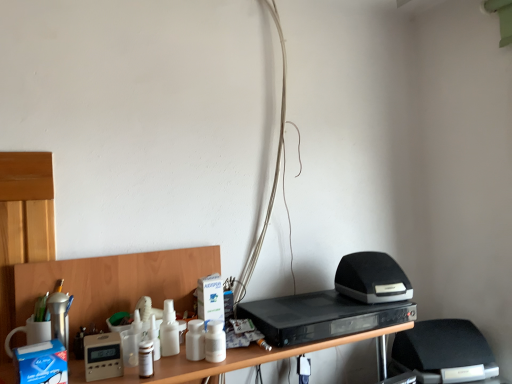
The image size is (512, 384). I want to click on blank space situated above black plastic dvd player at center (from a real-world perspective), so click(334, 309).